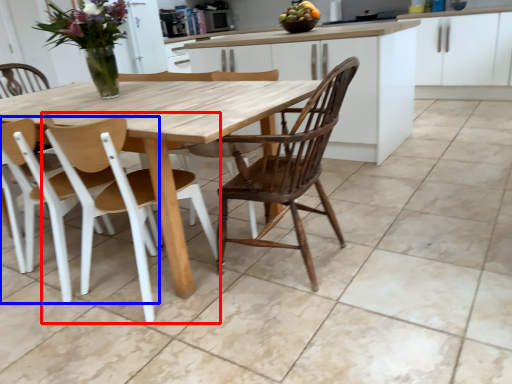
Question: Which point is further to the camera, chair (highlighted by a red box) or chair (highlighted by a blue box)?

Choices:
 (A) chair
 (B) chair

Answer: (B)